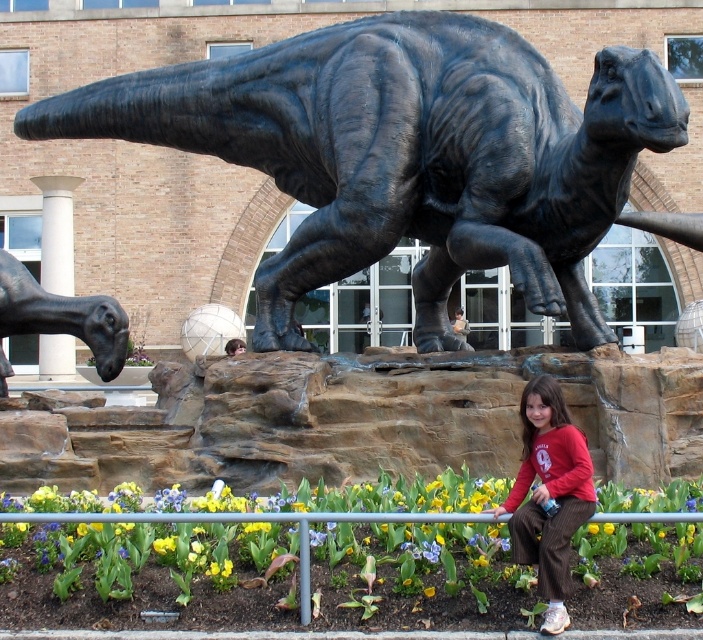
Looking at this image, you are standing in front of the dinosaur statue and want to take a photo that includes both the flower bed and the railing. If you focus on point A at point [181,132] and point B at point [574,452], which point is closer to your camera?

Point A at point [181,132] is closer to the camera than point B at point [574,452] because the description states that point [181,132] is further to the camera than point [574,452].